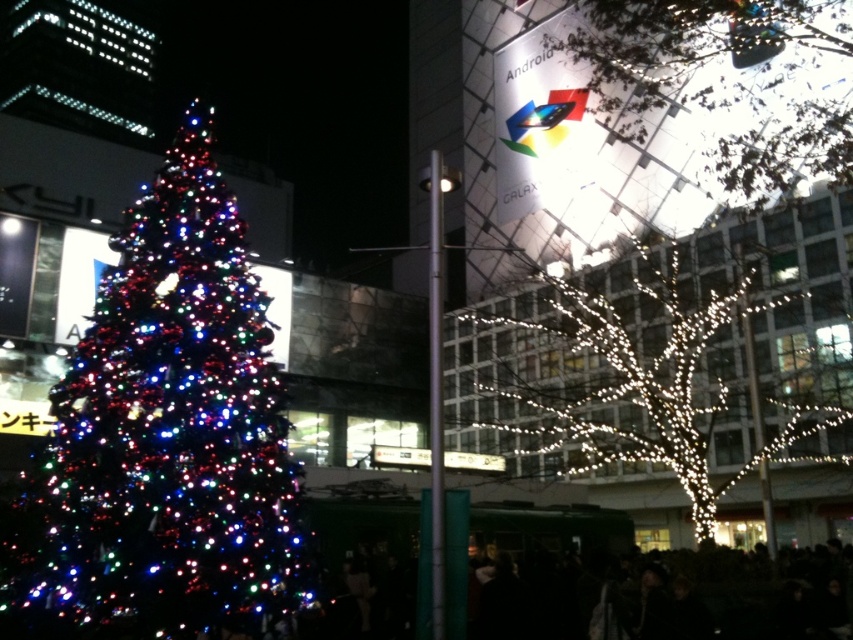
You are an electrician inspecting the wires in the image. You notice two wires, the illuminated wire at right and the illuminated wire at upper right. Which wire has a larger width?

The illuminated wire at right might be wider than the illuminated wire at upper right according to the description.

You are a photographer trying to capture the festive lights of the Christmas tree in the image. You notice a point marked at coordinates (166, 435). Based on the scene description, where is this point located relative to the Christmas tree?

The point at coordinates (166, 435) marks the multicolored lights at the left side of the Christmas tree, which is the focal point on the left side of the image.